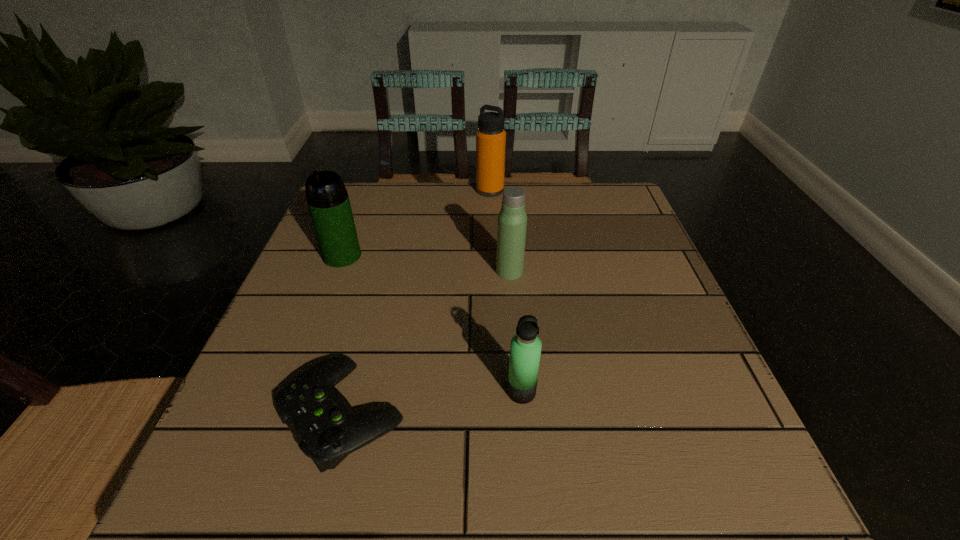
Identify which thermos bottle is the second closest to the leftmost thermos bottle. Please provide its 2D coordinates. Your answer should be formatted as a tuple, i.e. [(x, y)], where the tuple contains the x and y coordinates of a point satisfying the conditions above.

[(490, 137)]

At what (x,y) coordinates should I click in order to perform the action: click on blank area in the image that satisfies the following two spatial constraints: 1. from the spout of the shortest object; 2. on the left side of the leftmost thermos bottle. Please return your answer as a coordinate pair (x, y). This screenshot has width=960, height=540. Looking at the image, I should click on (283, 413).

In order to click on blank space that satisfies the following two spatial constraints: 1. from the spout of the control; 2. on the left side of the leftmost thermos bottle in this screenshot , I will do `click(283, 413)`.

This screenshot has height=540, width=960. In order to click on vacant area in the image that satisfies the following two spatial constraints: 1. from the spout of the nearest thermos bottle; 2. on the left side of the leftmost thermos bottle in this screenshot , I will do `click(291, 392)`.

This screenshot has width=960, height=540. What are the coordinates of `vacant area that satisfies the following two spatial constraints: 1. from the spout of the shortest object; 2. on the right side of the leftmost thermos bottle` in the screenshot? It's located at 283,413.